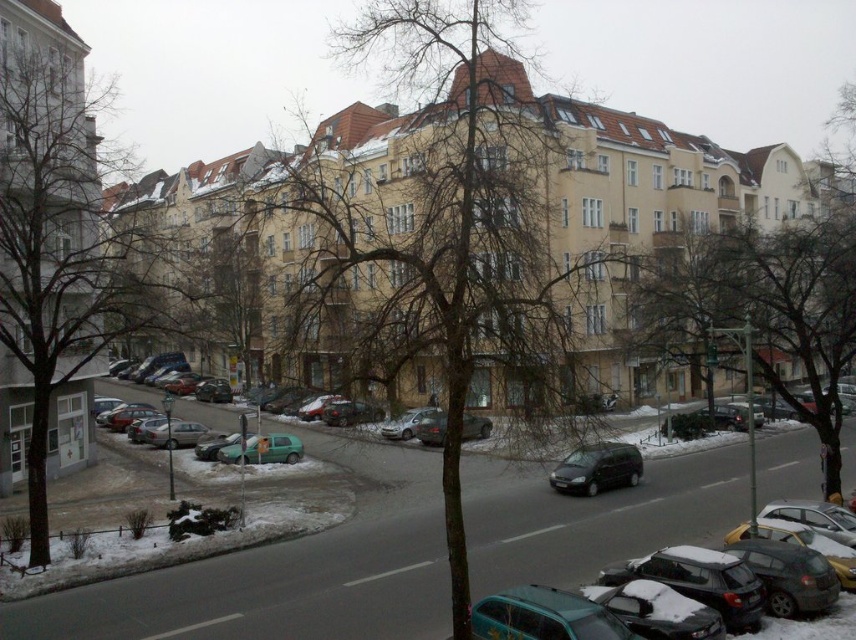
Is point (39, 296) more distant than point (575, 624)?

Yes.

Which of these two, brown bark tree at left or teal matte car at lower center, stands taller?

With more height is brown bark tree at left.

Image resolution: width=856 pixels, height=640 pixels. I want to click on brown bark tree at left, so click(62, 248).

Which is more to the left, brown textured tree at center or brown bark tree at left?

Positioned to the left is brown bark tree at left.

Who is more distant from viewer, (563, 362) or (33, 195)?

Positioned behind is point (33, 195).

Find the location of a particular element. The width and height of the screenshot is (856, 640). brown textured tree at center is located at coordinates (438, 234).

Identify the location of brown textured tree at center. The image size is (856, 640). (438, 234).

Looking at this image, can you confirm if teal matte car at lower center is positioned to the left of matte black van at center?

Indeed, teal matte car at lower center is positioned on the left side of matte black van at center.

Can you confirm if teal matte car at lower center is smaller than matte black van at center?

Yes.

Is point (498, 605) more distant than point (580, 480)?

No.

Locate an element on the screen. This screenshot has height=640, width=856. teal matte car at lower center is located at coordinates (544, 616).